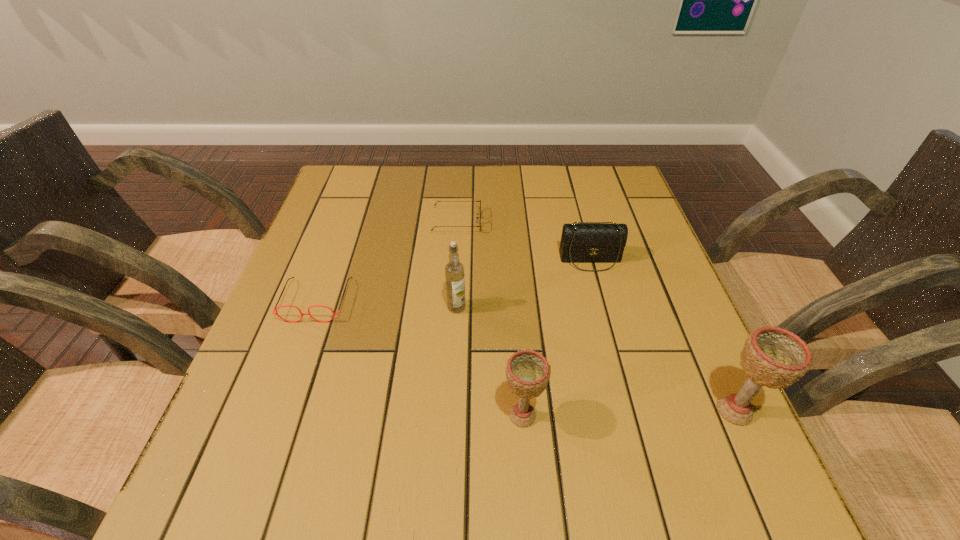
What are the coordinates of `the left chalice` in the screenshot? It's located at (527, 371).

I want to click on the fourth object from left to right, so coord(527,371).

I want to click on the rightmost object, so click(x=773, y=357).

The height and width of the screenshot is (540, 960). I want to click on the right chalice, so click(773, 357).

What are the coordinates of `clutch bag` in the screenshot? It's located at (580, 243).

I want to click on the fourth tallest object, so click(x=580, y=243).

Where is `the farthest object`? The height and width of the screenshot is (540, 960). the farthest object is located at coordinates (477, 218).

Locate an element on the screen. the shortest object is located at coordinates (477, 218).

Find the location of a particular element. vodka is located at coordinates click(454, 270).

At what (x,y) coordinates should I click in order to perform the action: click on spectacles. Please return your answer as a coordinate pair (x, y). Looking at the image, I should click on (275, 309).